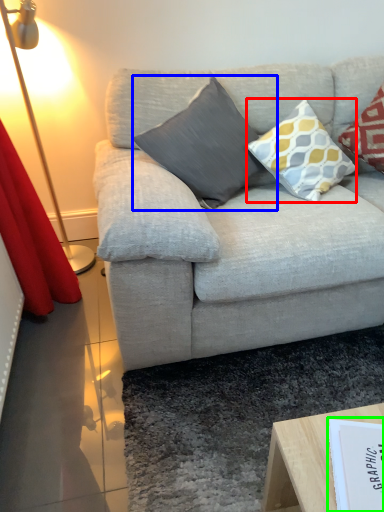
Question: Which is farther away from pillow (highlighted by a red box)? pillow (highlighted by a blue box) or paperback book (highlighted by a green box)?

Choices:
 (A) pillow
 (B) paperback book

Answer: (B)